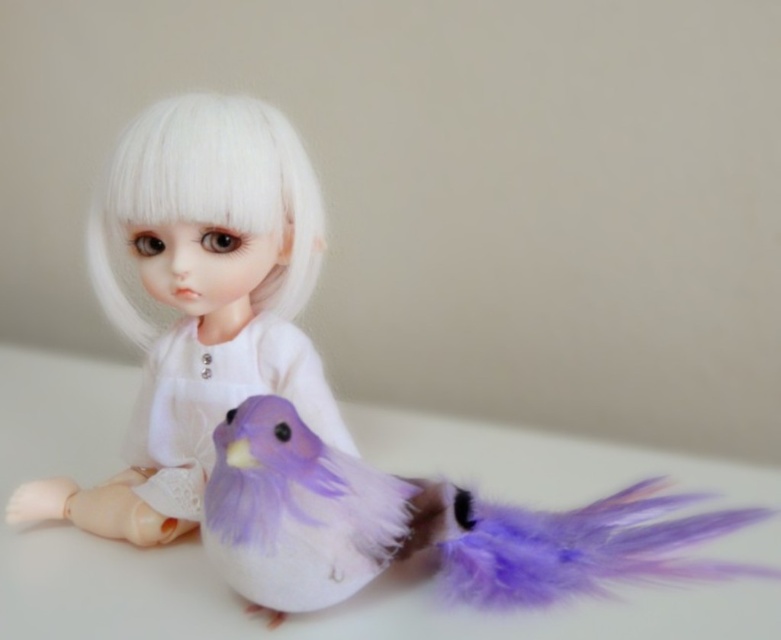
Question: Does white matte doll at center come in front of purple feathered bird at center?

Choices:
 (A) no
 (B) yes

Answer: (A)

Question: Does purple feathered bird at center appear over white silky hair at center?

Choices:
 (A) no
 (B) yes

Answer: (A)

Question: Which object is closer to the camera taking this photo?

Choices:
 (A) white matte doll at center
 (B) white silky hair at center

Answer: (B)

Question: Does purple feathered bird at center appear on the left side of white silky hair at center?

Choices:
 (A) no
 (B) yes

Answer: (A)

Question: Which point is closer to the camera?

Choices:
 (A) white matte doll at center
 (B) white silky hair at center
 (C) purple feathered bird at center

Answer: (C)

Question: Which point is closer to the camera?

Choices:
 (A) white silky hair at center
 (B) white matte doll at center

Answer: (A)